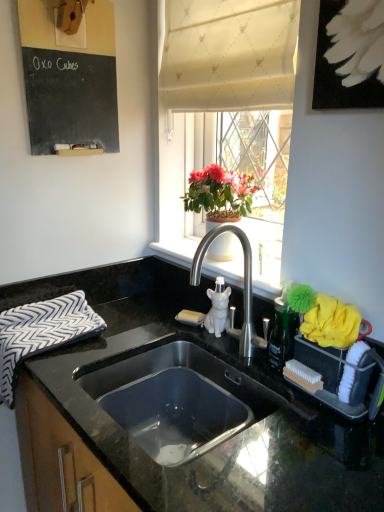
Question: Considering the relative positions of white fabric at upper center and black chalkboard at upper left in the image provided, is white fabric at upper center to the left of black chalkboard at upper left from the viewer's perspective?

Choices:
 (A) no
 (B) yes

Answer: (A)

Question: Considering the relative sizes of white fabric at upper center and black chalkboard at upper left in the image provided, is white fabric at upper center taller than black chalkboard at upper left?

Choices:
 (A) yes
 (B) no

Answer: (A)

Question: Is white fabric at upper center to the right of black chalkboard at upper left from the viewer's perspective?

Choices:
 (A) yes
 (B) no

Answer: (A)

Question: Is black chalkboard at upper left a part of white fabric at upper center?

Choices:
 (A) no
 (B) yes

Answer: (A)

Question: From a real-world perspective, is white fabric at upper center over black chalkboard at upper left?

Choices:
 (A) no
 (B) yes

Answer: (A)

Question: Is white ceramic window sill at upper center bigger or smaller than white textured curtain at upper center?

Choices:
 (A) big
 (B) small

Answer: (B)

Question: Do you think white ceramic window sill at upper center is within white textured curtain at upper center, or outside of it?

Choices:
 (A) inside
 (B) outside

Answer: (B)

Question: From a real-world perspective, relative to white textured curtain at upper center, is white ceramic window sill at upper center vertically above or below?

Choices:
 (A) below
 (B) above

Answer: (A)

Question: Is white ceramic window sill at upper center taller or shorter than white textured curtain at upper center?

Choices:
 (A) short
 (B) tall

Answer: (A)

Question: Considering the positions of white fabric at upper center and black chalkboard at upper left in the image, is white fabric at upper center wider or thinner than black chalkboard at upper left?

Choices:
 (A) wide
 (B) thin

Answer: (A)

Question: Considering the positions of point click(x=269, y=238) and point click(x=56, y=84), is point click(x=269, y=238) closer or farther from the camera than point click(x=56, y=84)?

Choices:
 (A) closer
 (B) farther

Answer: (B)

Question: Choose the correct answer: Is white fabric at upper center inside black chalkboard at upper left or outside it?

Choices:
 (A) inside
 (B) outside

Answer: (B)

Question: From the image's perspective, is white fabric at upper center above or below black chalkboard at upper left?

Choices:
 (A) below
 (B) above

Answer: (A)

Question: From the image's perspective, is black granite countertop at center positioned above or below black and white zigzag fabric hand towel at left?

Choices:
 (A) above
 (B) below

Answer: (B)

Question: Would you say black granite countertop at center is to the left or to the right of black and white zigzag fabric hand towel at left in the picture?

Choices:
 (A) right
 (B) left

Answer: (A)